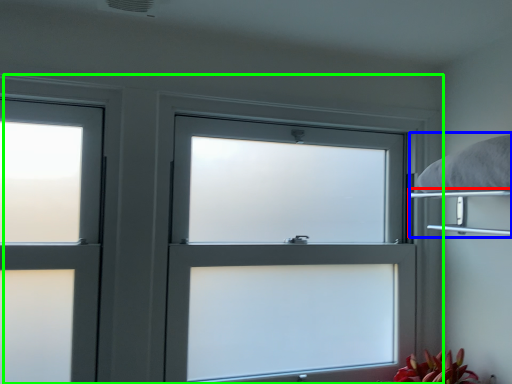
Question: Which object is positioned closest to shelf (highlighted by a red box)? Select from bed (highlighted by a blue box) and window (highlighted by a green box).

Choices:
 (A) bed
 (B) window

Answer: (A)